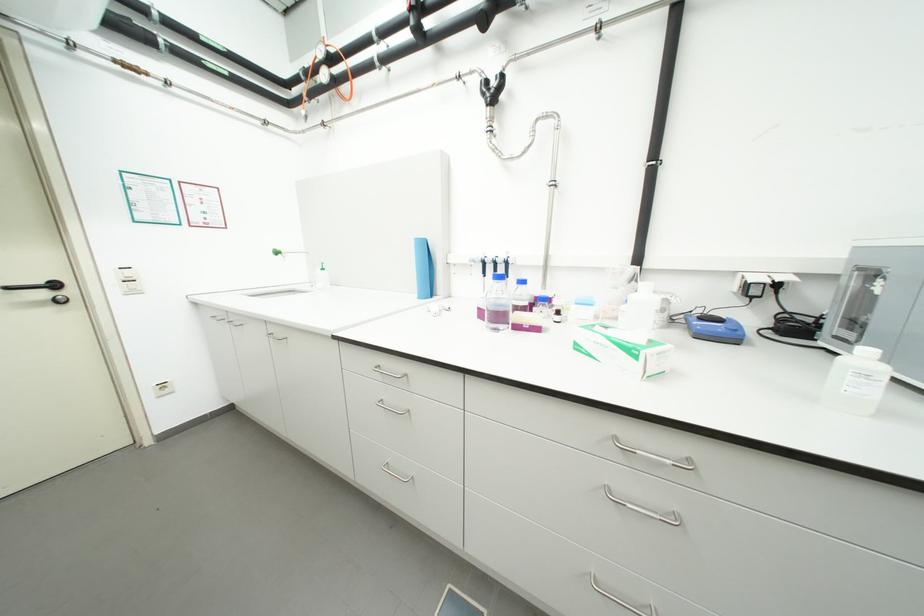
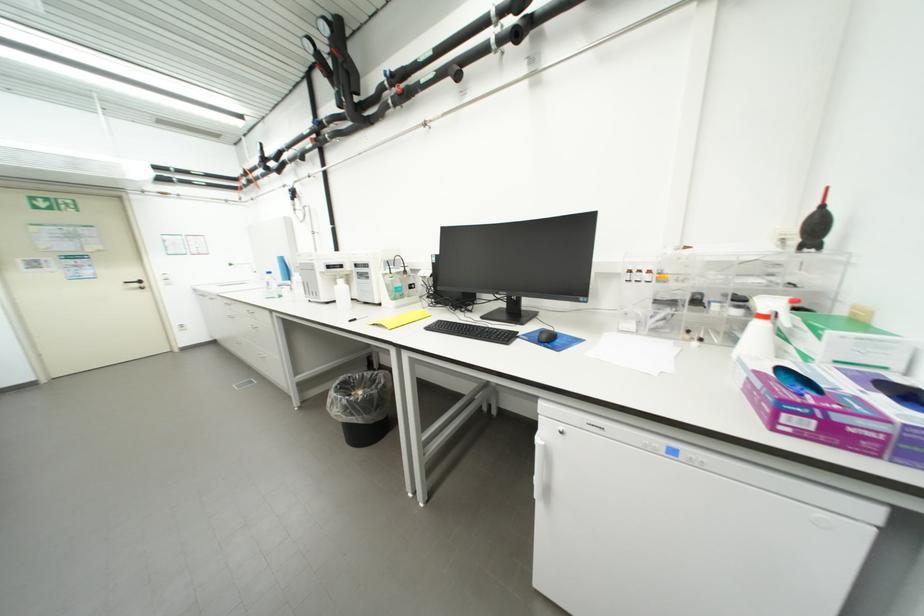
Find the pixel in the second image that matches the point at 52,296 in the first image.

(144, 286)